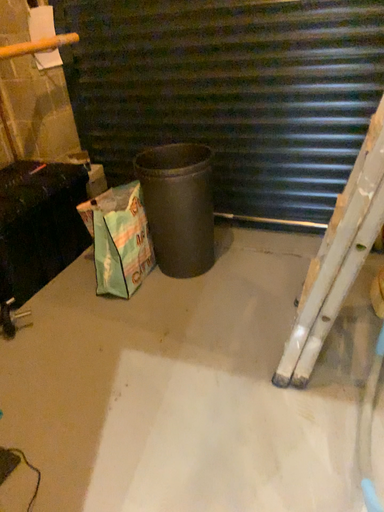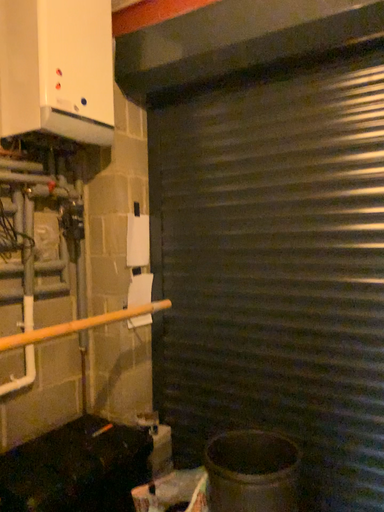
Question: How did the camera likely rotate when shooting the video?

Choices:
 (A) rotated upward
 (B) rotated downward

Answer: (A)